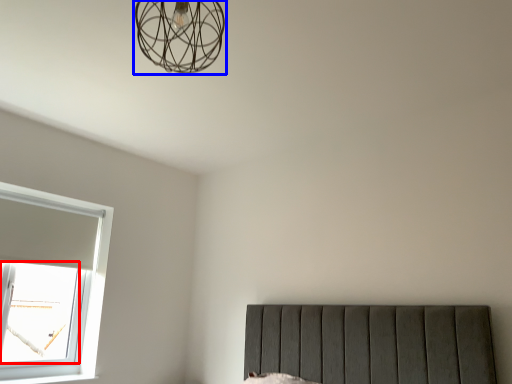
Question: Among these objects, which one is nearest to the camera, window screen (highlighted by a red box) or lamp (highlighted by a blue box)?

Choices:
 (A) window screen
 (B) lamp

Answer: (B)